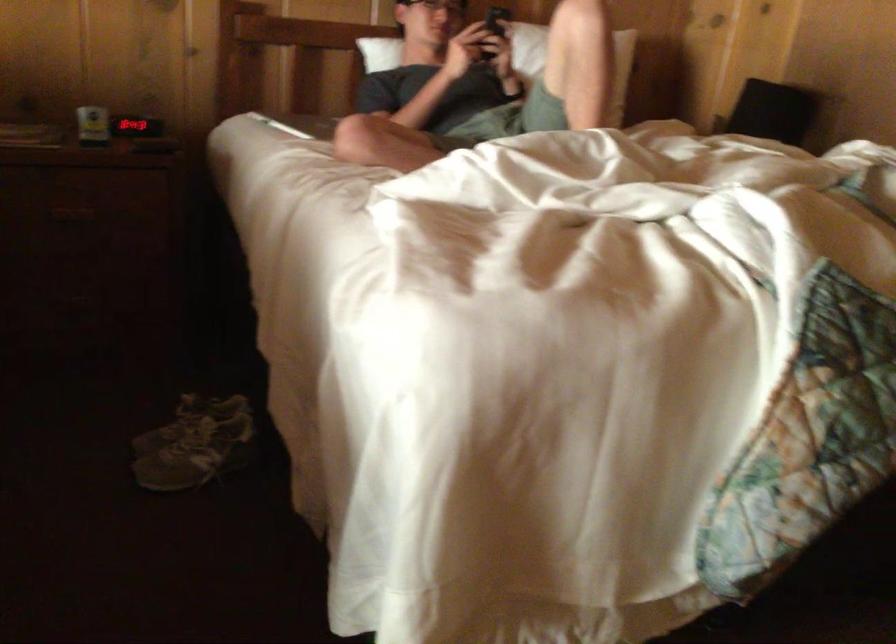
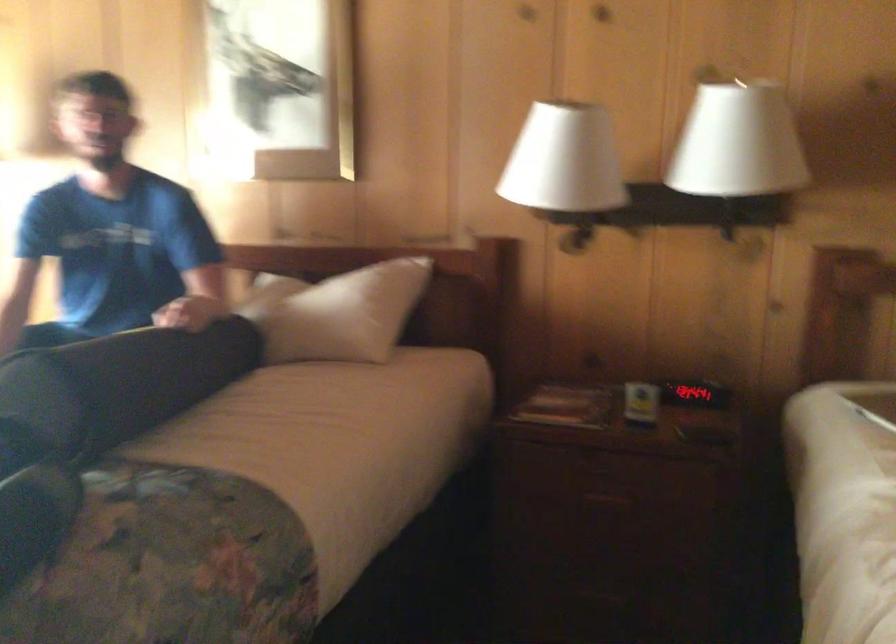
Locate, in the second image, the point that corresponds to point 134,128 in the first image.

(694, 393)